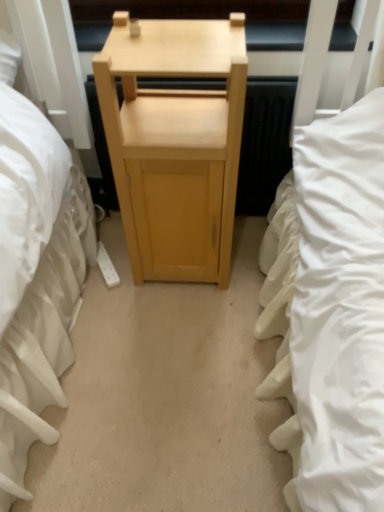
Identify the location of free location in front of light wood nightstand at center. (180, 333).